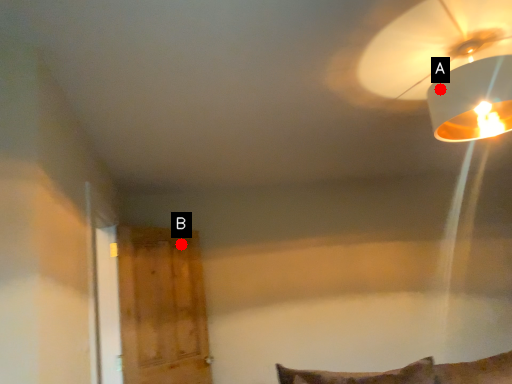
Question: Two points are circled on the image, labeled by A and B beside each circle. Which of the following is the farthest from the observer?

Choices:
 (A) A is further
 (B) B is further

Answer: (B)